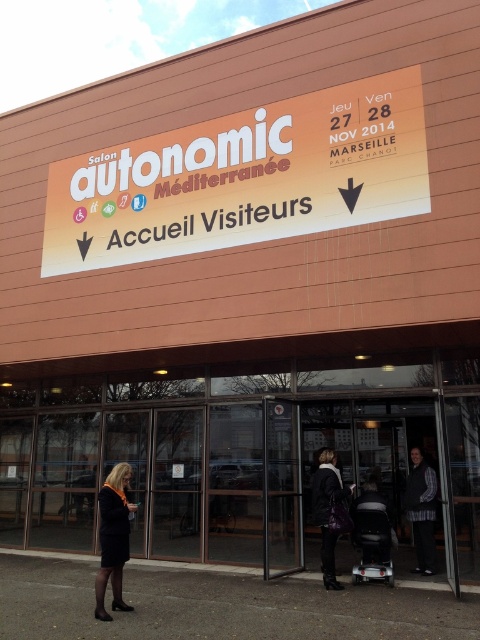
You are at the event location and need to decide which coat to take. The black wool coat at lower left is smaller than the dark brown leather jacket at center. Which coat is more suitable for carrying a large bag?

The dark brown leather jacket at center is more suitable for carrying a large bag since it has a larger size compared to the black wool coat at lower left.

You are standing in front of the building with the orange signboard. You need to find the black wool coat at lower left. According to the spatial coordinates provided, where exactly should you look to locate it?

The black wool coat at lower left is located at point coordinates 0.842 on the x axis and 0.237 on the y axis.

What is the spatial relationship between the black wool coat at lower left and the dark brown leather jacket at center?

The black wool coat at lower left is to the left of the dark brown leather jacket at center.